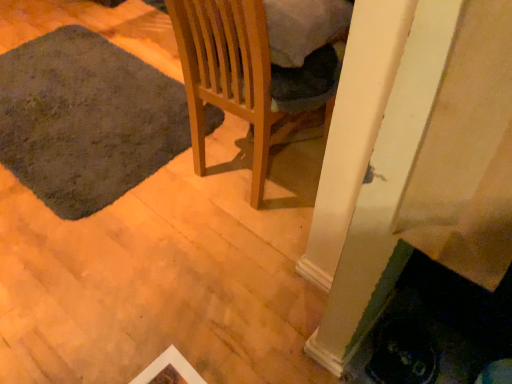
Find the location of `free area in between wooden chair at center and dark gray carpet at lower left`. free area in between wooden chair at center and dark gray carpet at lower left is located at coordinates (165, 181).